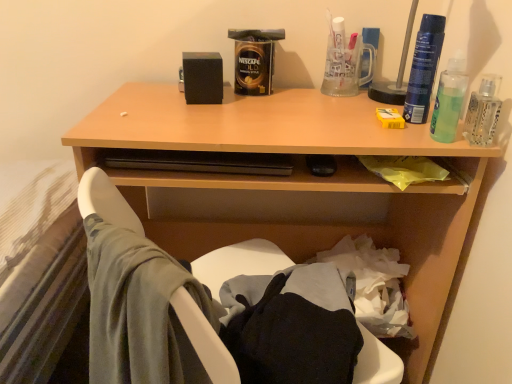
This screenshot has height=384, width=512. I want to click on vacant space in front of blue plastic spray can at upper right, acting as the second bottle starting from the right, so click(413, 131).